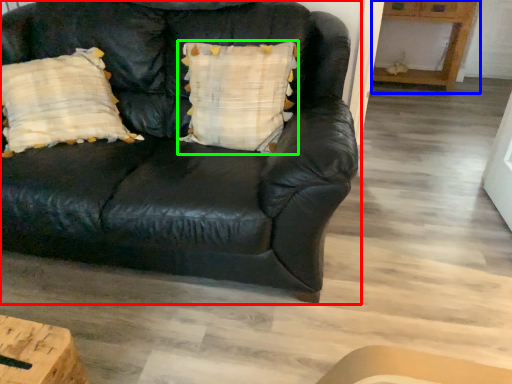
Question: Which object is the closest to the studio couch (highlighted by a red box)? Choose among these: table (highlighted by a blue box) or pillow (highlighted by a green box).

Choices:
 (A) table
 (B) pillow

Answer: (B)